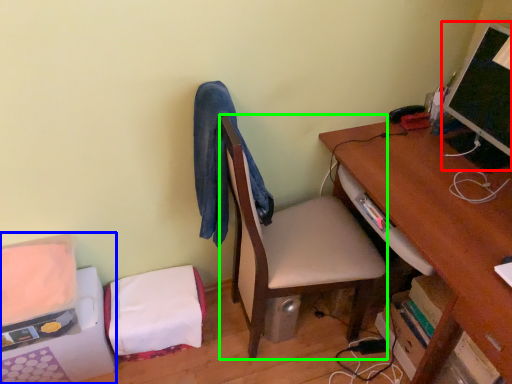
Question: Which is nearer to the computer monitor (highlighted by a red box)? furniture (highlighted by a blue box) or table (highlighted by a green box).

Choices:
 (A) furniture
 (B) table

Answer: (B)